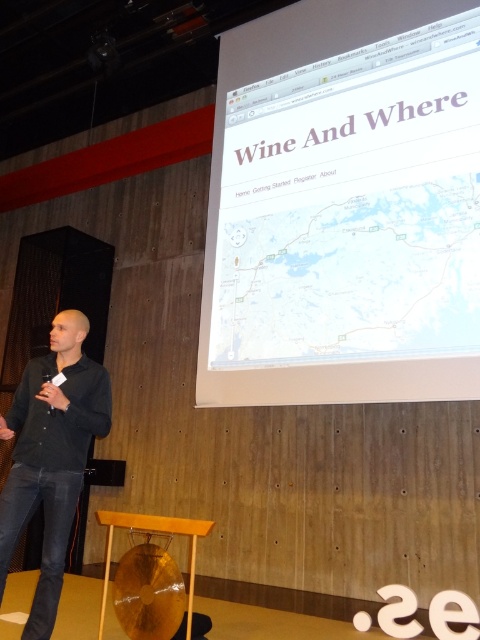
Between white paper at upper center and black matte shirt at left, which one appears on the left side from the viewer's perspective?

black matte shirt at left is more to the left.

Is white paper at upper center smaller than black matte shirt at left?

Actually, white paper at upper center might be larger than black matte shirt at left.

Image resolution: width=480 pixels, height=640 pixels. I want to click on white paper at upper center, so click(345, 205).